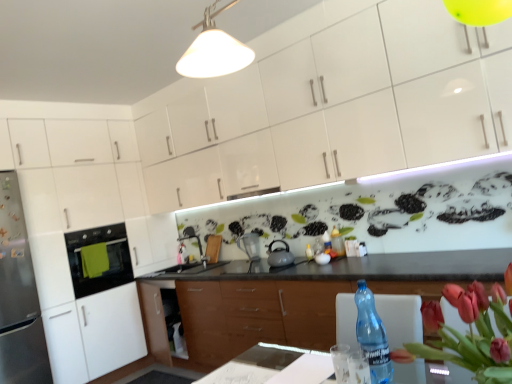
This screenshot has height=384, width=512. Describe the element at coordinates (256, 315) in the screenshot. I see `wooden cabinet at center, which is counted as the 3th cabinetry, starting from the top` at that location.

Measure the distance between white glossy cabinet at left, the 2th cabinetry when ordered from bottom to top, and camera.

3.48 meters.

The image size is (512, 384). Describe the element at coordinates (340, 362) in the screenshot. I see `clear glass water at table center` at that location.

You are a GUI agent. You are given a task and a screenshot of the screen. Output one action in this format:
    pyautogui.click(x=<x>, y=<y>)
    Task: Click on the white glossy cabinets at upper center, placed as the first cabinetry when sorted from top to bottom
    This screenshot has height=384, width=512.
    Given the screenshot: What is the action you would take?
    pyautogui.click(x=327, y=108)

This screenshot has height=384, width=512. What are the coordinates of `wooden cabinet at center, which is counted as the 3th cabinetry, starting from the top` in the screenshot? It's located at (256, 315).

Is point (80, 190) closer or farther from the camera than point (47, 375)?

Clearly, point (80, 190) is more distant from the camera than point (47, 375).

I want to click on refrigerator below the white glossy cabinet at left, marked as the 2th cabinetry in a top-to-bottom arrangement (from a real-world perspective), so click(x=19, y=295).

From the image's perspective, which object appears higher, white glossy cabinet at left, the 2th cabinetry when ordered from bottom to top, or satin silver refrigerator at left?

From the image's view, white glossy cabinet at left, the 2th cabinetry when ordered from bottom to top, is above.

Considering the relative sizes of matte silver pitcher at center and matte gray tea pot at center in the image provided, is matte silver pitcher at center wider than matte gray tea pot at center?

No, matte silver pitcher at center is not wider than matte gray tea pot at center.

Where is `appliance on the left of matte gray tea pot at center`? The image size is (512, 384). appliance on the left of matte gray tea pot at center is located at coordinates (250, 245).

From the image's perspective, is matte silver pitcher at center above matte gray tea pot at center?

Incorrect, from the image's perspective, matte silver pitcher at center is lower than matte gray tea pot at center.

From a real-world perspective, between matte silver pitcher at center and matte gray tea pot at center, who is vertically lower?

matte gray tea pot at center, from a real-world perspective.

In the scene shown: Could you measure the distance between white glossy cabinet at left, the 2th cabinetry when ordered from bottom to top, and white glossy cabinets at upper center, placed as the first cabinetry when sorted from top to bottom?

5.49 feet.

Looking at this image, could you tell me if white glossy cabinet at left, marked as the 2th cabinetry in a top-to-bottom arrangement, is turned towards white glossy cabinets at upper center, placed as the third cabinetry when sorted from bottom to top?

Yes, white glossy cabinet at left, marked as the 2th cabinetry in a top-to-bottom arrangement, is facing white glossy cabinets at upper center, placed as the third cabinetry when sorted from bottom to top.

Which is more to the left, white glossy cabinet at left, the 2th cabinetry when ordered from bottom to top, or white glossy cabinets at upper center, placed as the third cabinetry when sorted from bottom to top?

white glossy cabinet at left, the 2th cabinetry when ordered from bottom to top, is more to the left.

Is the depth of white glossy cabinet at left, marked as the 2th cabinetry in a top-to-bottom arrangement, greater than that of white glossy cabinets at upper center, placed as the first cabinetry when sorted from top to bottom?

Yes.

Is there a large distance between white glossy cabinets at upper center, placed as the third cabinetry when sorted from bottom to top, and transparent plastic bottle at lower right?

Yes, white glossy cabinets at upper center, placed as the third cabinetry when sorted from bottom to top, is far from transparent plastic bottle at lower right.

In terms of height, does white glossy cabinets at upper center, placed as the first cabinetry when sorted from top to bottom, look taller or shorter compared to transparent plastic bottle at lower right?

Clearly, white glossy cabinets at upper center, placed as the first cabinetry when sorted from top to bottom, is taller compared to transparent plastic bottle at lower right.

Between white glossy cabinets at upper center, placed as the third cabinetry when sorted from bottom to top, and transparent plastic bottle at lower right, which one has smaller width?

transparent plastic bottle at lower right is thinner.

Is white glossy cabinets at upper center, placed as the first cabinetry when sorted from top to bottom, bigger than transparent plastic bottle at lower right?

Yes, white glossy cabinets at upper center, placed as the first cabinetry when sorted from top to bottom, is bigger than transparent plastic bottle at lower right.

Which of these two, black matte oven at left or matte gray tea pot at center, stands shorter?

matte gray tea pot at center is shorter.

How many degrees apart are the facing directions of black matte oven at left and matte gray tea pot at center?

88.7 degrees separate the facing orientations of black matte oven at left and matte gray tea pot at center.

Considering the positions of objects black matte oven at left and matte gray tea pot at center in the image provided, who is more to the left, black matte oven at left or matte gray tea pot at center?

black matte oven at left.

How different are the orientations of matte gray tea pot at center and wooden cabinet at center, which is counted as the 3th cabinetry, starting from the top, in degrees?

There is a 1.27-degree angle between the facing directions of matte gray tea pot at center and wooden cabinet at center, which is counted as the 3th cabinetry, starting from the top.

Considering the positions of points (288, 261) and (288, 333), is point (288, 261) farther from camera compared to point (288, 333)?

Yes, point (288, 261) is behind point (288, 333).

From the image's perspective, relative to wooden cabinet at center, which is counted as the 3th cabinetry, starting from the top, is matte gray tea pot at center above or below?

matte gray tea pot at center is situated higher than wooden cabinet at center, which is counted as the 3th cabinetry, starting from the top, in the image.

Would you say matte gray tea pot at center is a long distance from wooden cabinet at center, which is counted as the 3th cabinetry, starting from the top?

No, matte gray tea pot at center is not far away from wooden cabinet at center, which is counted as the 3th cabinetry, starting from the top.

Considering the sizes of matte silver pitcher at center and vivid red petals at right in the image, is matte silver pitcher at center taller or shorter than vivid red petals at right?

Clearly, matte silver pitcher at center is shorter compared to vivid red petals at right.

Is matte silver pitcher at center outside of vivid red petals at right?

matte silver pitcher at center lies outside vivid red petals at right's area.

Is there a large distance between matte silver pitcher at center and vivid red petals at right?

Indeed, matte silver pitcher at center is not near vivid red petals at right.

Is matte silver pitcher at center positioned with its back to vivid red petals at right?

No.

There is a satin silver refrigerator at left. What are the coordinates of `the 1st cabinetry above it (from the image's perspective)` in the screenshot? It's located at (79, 229).

Locate an element on the screen. This screenshot has width=512, height=384. appliance that is above the matte gray tea pot at center (from a real-world perspective) is located at coordinates (250, 245).

Looking at the image, which one is located further to satin silver refrigerator at left, white glossy cabinets at upper center, placed as the third cabinetry when sorted from bottom to top, or vivid red petals at right?

vivid red petals at right is positioned further to the anchor satin silver refrigerator at left.

When comparing their distances from satin silver refrigerator at left, does matte gray tea pot at center or vivid red petals at right seem further?

vivid red petals at right lies further to satin silver refrigerator at left than the other object.

Which object lies nearer to the anchor point vivid red petals at right, matte gray tea pot at center or clear glass water at table center?

Among the two, clear glass water at table center is located nearer to vivid red petals at right.

Considering their positions, is white glossy cabinet at left, marked as the 2th cabinetry in a top-to-bottom arrangement, positioned closer to matte gray tea pot at center than clear glass water at table center?

clear glass water at table center lies closer to matte gray tea pot at center than the other object.

Consider the image. Considering their positions, is wooden cabinet at center, the 1th cabinetry ordered from the bottom, positioned closer to white glossy cabinets at upper center, placed as the first cabinetry when sorted from top to bottom, than white glossy cabinet at left, the 2th cabinetry when ordered from bottom to top?

wooden cabinet at center, the 1th cabinetry ordered from the bottom, lies closer to white glossy cabinets at upper center, placed as the first cabinetry when sorted from top to bottom, than the other object.

Estimate the real-world distances between objects in this image. Which object is further from white glossy cabinet at left, the 2th cabinetry when ordered from bottom to top, black matte oven at left or clear glass water at table center?

Among the two, clear glass water at table center is located further to white glossy cabinet at left, the 2th cabinetry when ordered from bottom to top.

Which object lies further to the anchor point white glossy cabinet at left, the 2th cabinetry when ordered from bottom to top, black matte oven at left or black matte sink at center?

Based on the image, black matte sink at center appears to be further to white glossy cabinet at left, the 2th cabinetry when ordered from bottom to top.

Considering their positions, is white glossy cabinets at upper center, placed as the third cabinetry when sorted from bottom to top, positioned further to matte gray tea pot at center than satin silver refrigerator at left?

Among the two, satin silver refrigerator at left is located further to matte gray tea pot at center.

Where is `appliance located between transparent plastic bottle at lower right and black matte oven at left in the depth direction`? Image resolution: width=512 pixels, height=384 pixels. appliance located between transparent plastic bottle at lower right and black matte oven at left in the depth direction is located at coordinates (250, 245).

Locate an element on the screen. The height and width of the screenshot is (384, 512). appliance between satin silver refrigerator at left and clear glass water at table center from left to right is located at coordinates (250, 245).

This screenshot has height=384, width=512. In order to click on appliance between vivid red petals at right and black matte sink at center in the front-back direction in this screenshot , I will do `click(250, 245)`.

Find the location of a particular element. water between vivid red petals at right and wooden cabinet at center, which is counted as the 3th cabinetry, starting from the top, from front to back is located at coordinates (340, 362).